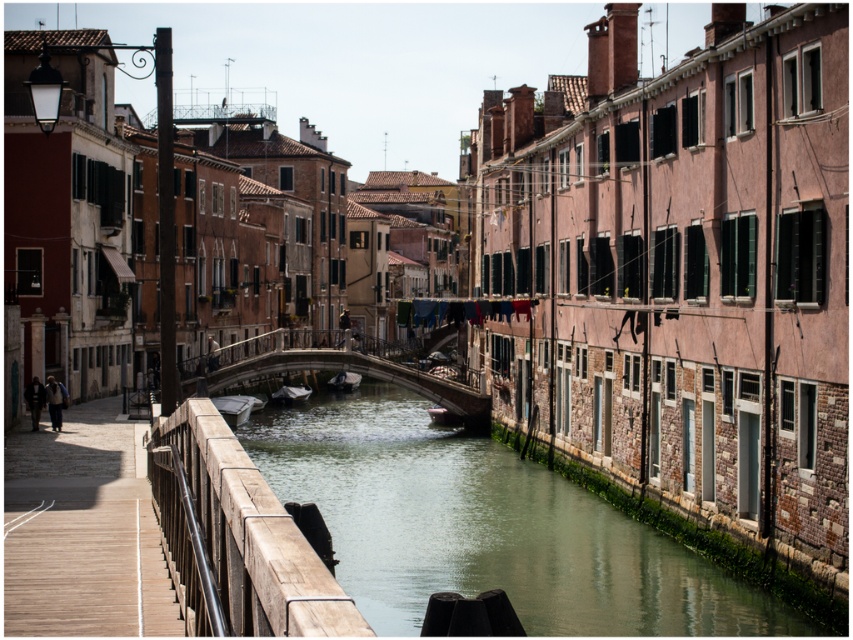
Question: Which of the following is the farthest from the observer?

Choices:
 (A) concrete stone bridge at center
 (B) wooden rail at lower left

Answer: (A)

Question: Is concrete stone bridge at center smaller than dark gray wooden boat at center?

Choices:
 (A) no
 (B) yes

Answer: (A)

Question: Observing the image, what is the correct spatial positioning of white matte boat at center in reference to dark gray wooden boat at center?

Choices:
 (A) below
 (B) above

Answer: (A)

Question: From the image, what is the correct spatial relationship of dark brown wooden boat at center in relation to smooth white boat at center?

Choices:
 (A) right
 (B) left

Answer: (A)

Question: Which point is farther from the camera taking this photo?

Choices:
 (A) (355, 381)
 (B) (281, 394)
 (C) (247, 358)
 (D) (212, 401)

Answer: (A)

Question: Estimate the real-world distances between objects in this image. Which object is closer to the dark brown wooden boat at center?

Choices:
 (A) concrete stone bridge at center
 (B) dark gray wooden boat at center
 (C) smooth white boat at center
 (D) white matte boat at center

Answer: (A)